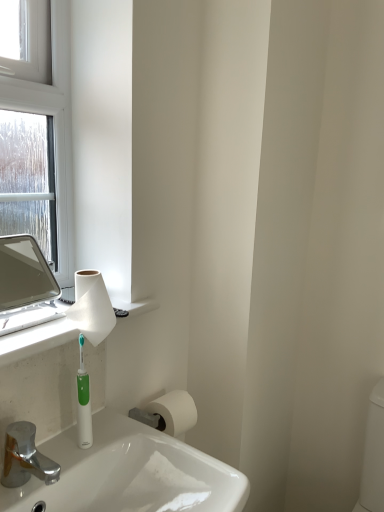
Based on the photo, measure the distance between chrome metallic faucet at lower left and camera.

chrome metallic faucet at lower left and camera are 29.02 inches apart.

This screenshot has width=384, height=512. In order to click on chrome metallic faucet at lower left in this screenshot , I will do `click(25, 457)`.

Image resolution: width=384 pixels, height=512 pixels. What do you see at coordinates (24, 274) in the screenshot?
I see `matte silver mirror at left` at bounding box center [24, 274].

Where is `green plastic toothbrush at lower left`? The width and height of the screenshot is (384, 512). green plastic toothbrush at lower left is located at coordinates (83, 403).

What are the coordinates of `white paper towel at upper left, which appears as the second toilet paper when viewed from the right` in the screenshot? It's located at (92, 307).

The image size is (384, 512). I want to click on chrome metallic faucet at lower left, so click(x=25, y=457).

Is chrome metallic faucet at lower left facing away from white matte countertop at left?

No.

Which is in front, point (56, 467) or point (89, 309)?

The point (56, 467) is in front.

Based on the photo, from the image's perspective, which one is positioned higher, chrome metallic faucet at lower left or white matte countertop at left?

white matte countertop at left appears higher in the image.

Relative to white matte countertop at left, is chrome metallic faucet at lower left in front or behind?

Clearly, chrome metallic faucet at lower left is in front of white matte countertop at left.

From a real-world perspective, is green plastic toothbrush at lower left under white matte countertop at left?

Yes, from a real-world perspective, green plastic toothbrush at lower left is beneath white matte countertop at left.

Relative to white matte countertop at left, is green plastic toothbrush at lower left in front or behind?

Visually, green plastic toothbrush at lower left is located behind white matte countertop at left.

Can you confirm if green plastic toothbrush at lower left is wider than white matte countertop at left?

Incorrect, the width of green plastic toothbrush at lower left does not surpass that of white matte countertop at left.

Between green plastic toothbrush at lower left and white matte countertop at left, which one appears on the right side from the viewer's perspective?

Positioned to the right is green plastic toothbrush at lower left.

Considering the sizes of objects chrome metallic faucet at lower left and green plastic toothbrush at lower left in the image provided, who is wider, chrome metallic faucet at lower left or green plastic toothbrush at lower left?

chrome metallic faucet at lower left is wider.

Is chrome metallic faucet at lower left in front of green plastic toothbrush at lower left?

Yes, it is in front of green plastic toothbrush at lower left.

Does chrome metallic faucet at lower left have a lesser height compared to green plastic toothbrush at lower left?

Correct, chrome metallic faucet at lower left is not as tall as green plastic toothbrush at lower left.

From the image's perspective, would you say white matte countertop at left is positioned over chrome metallic faucet at lower left?

Yes.

Considering the sizes of objects white matte countertop at left and chrome metallic faucet at lower left in the image provided, who is wider, white matte countertop at left or chrome metallic faucet at lower left?

white matte countertop at left.

Considering the positions of objects white matte countertop at left and chrome metallic faucet at lower left in the image provided, who is more to the left, white matte countertop at left or chrome metallic faucet at lower left?

white matte countertop at left is more to the left.

Considering the positions of points (58, 325) and (57, 479), is point (58, 325) farther from camera compared to point (57, 479)?

That is True.

Can you confirm if white matte toilet paper at lower center, the 2th toilet paper positioned from the left, is smaller than white matte countertop at left?

Correct, white matte toilet paper at lower center, the 2th toilet paper positioned from the left, occupies less space than white matte countertop at left.

Which object is closer to the camera taking this photo, white matte toilet paper at lower center, the 2th toilet paper when ordered from top to bottom, or white matte countertop at left?

A: white matte countertop at left is more forward.

I want to click on counter top that appears on the left of white matte toilet paper at lower center, which appears as the 2th toilet paper when viewed from the front, so click(x=57, y=332).

In the scene shown: From the image's perspective, is white matte toilet paper at lower center, which appears as the 2th toilet paper when viewed from the front, under white matte countertop at left?

Yes, from the image's perspective, white matte toilet paper at lower center, which appears as the 2th toilet paper when viewed from the front, is below white matte countertop at left.

Can you tell me how much white matte toilet paper at lower center, the 1th toilet paper in the right-to-left sequence, and chrome metallic faucet at lower left differ in facing direction?

white matte toilet paper at lower center, the 1th toilet paper in the right-to-left sequence, and chrome metallic faucet at lower left are facing 1.8 degrees away from each other.

Is white matte toilet paper at lower center, the 2th toilet paper when ordered from top to bottom, far from chrome metallic faucet at lower left?

No.

Which of these two, white matte toilet paper at lower center, which appears as the 2th toilet paper when viewed from the front, or chrome metallic faucet at lower left, stands taller?

Standing taller between the two is white matte toilet paper at lower center, which appears as the 2th toilet paper when viewed from the front.

Considering the positions of point (157, 399) and point (12, 478), is point (157, 399) closer or farther from the camera than point (12, 478)?

Point (157, 399) is positioned farther from the camera compared to point (12, 478).

Does chrome metallic faucet at lower left have a larger size compared to matte silver mirror at left?

No.

From a real-world perspective, relative to matte silver mirror at left, is chrome metallic faucet at lower left vertically above or below?

chrome metallic faucet at lower left is situated lower than matte silver mirror at left in the real world.

Considering their positions, is chrome metallic faucet at lower left located in front of or behind matte silver mirror at left?

Visually, chrome metallic faucet at lower left is located in front of matte silver mirror at left.

Identify the location of tap below the matte silver mirror at left (from the image's perspective). This screenshot has width=384, height=512. (25, 457).

Identify the location of tap on the right of white matte countertop at left. (25, 457).

Locate an element on the screen. counter top on the left of the green plastic toothbrush at lower left is located at coordinates (57, 332).

When comparing their distances from white matte toilet paper at lower center, the 1th toilet paper in the right-to-left sequence, does green plastic toothbrush at lower left or white paper towel at upper left, arranged as the second toilet paper when ordered from the bottom, seem further?

The object further to white matte toilet paper at lower center, the 1th toilet paper in the right-to-left sequence, is white paper towel at upper left, arranged as the second toilet paper when ordered from the bottom.

When comparing their distances from green plastic toothbrush at lower left, does white matte countertop at left or matte silver mirror at left seem closer?

white matte countertop at left lies closer to green plastic toothbrush at lower left than the other object.

Considering their positions, is matte silver mirror at left positioned closer to green plastic toothbrush at lower left than chrome metallic faucet at lower left?

chrome metallic faucet at lower left lies closer to green plastic toothbrush at lower left than the other object.

Estimate the real-world distances between objects in this image. Which object is closer to white matte toilet paper at lower center, the 2th toilet paper positioned from the left, chrome metallic faucet at lower left or green plastic toothbrush at lower left?

green plastic toothbrush at lower left is closer to white matte toilet paper at lower center, the 2th toilet paper positioned from the left.

Considering their positions, is white matte countertop at left positioned further to white paper towel at upper left, arranged as the first toilet paper when viewed from the left, than matte silver mirror at left?

Among the two, matte silver mirror at left is located further to white paper towel at upper left, arranged as the first toilet paper when viewed from the left.

Estimate the real-world distances between objects in this image. Which object is closer to matte silver mirror at left, green plastic toothbrush at lower left or white matte toilet paper at lower center, acting as the 1th toilet paper starting from the back?

Among the two, white matte toilet paper at lower center, acting as the 1th toilet paper starting from the back, is located nearer to matte silver mirror at left.

Based on their spatial positions, is white matte toilet paper at lower center, the 2th toilet paper positioned from the left, or white paper towel at upper left, which appears as the second toilet paper when viewed from the right, further from green plastic toothbrush at lower left?

white matte toilet paper at lower center, the 2th toilet paper positioned from the left, is further to green plastic toothbrush at lower left.

Based on their spatial positions, is matte silver mirror at left or white matte toilet paper at lower center, which appears as the 2th toilet paper when viewed from the front, further from chrome metallic faucet at lower left?

Based on the image, matte silver mirror at left appears to be further to chrome metallic faucet at lower left.

This screenshot has width=384, height=512. In order to click on mouthwash between white paper towel at upper left, arranged as the second toilet paper when ordered from the bottom, and chrome metallic faucet at lower left, in the vertical direction in this screenshot , I will do `click(83, 403)`.

Where is `counter top between white paper towel at upper left, arranged as the first toilet paper when viewed from the left, and chrome metallic faucet at lower left from top to bottom`? counter top between white paper towel at upper left, arranged as the first toilet paper when viewed from the left, and chrome metallic faucet at lower left from top to bottom is located at coordinates (57, 332).

The image size is (384, 512). Identify the location of mouthwash between matte silver mirror at left and white matte toilet paper at lower center, the 2th toilet paper positioned from the left, vertically. pyautogui.click(x=83, y=403).

You are a GUI agent. You are given a task and a screenshot of the screen. Output one action in this format:
    pyautogui.click(x=<x>, y=<y>)
    Task: Click on the counter top between white paper towel at upper left, arranged as the second toilet paper when ordered from the bottom, and white matte toilet paper at lower center, positioned as the first toilet paper in bottom-to-top order, from top to bottom
    The height and width of the screenshot is (512, 384).
    Given the screenshot: What is the action you would take?
    pyautogui.click(x=57, y=332)